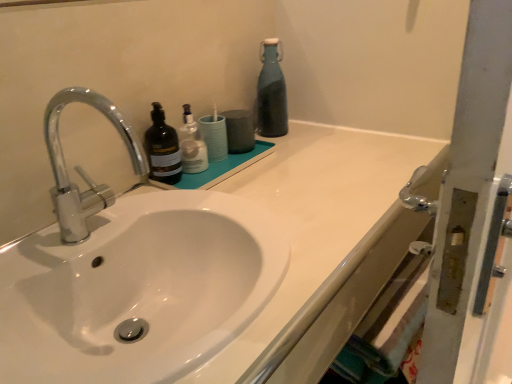
Question: Is teal glass bottle at upper right, the 1th bottle positioned from the back, bigger than white glossy sink at center?

Choices:
 (A) yes
 (B) no

Answer: (B)

Question: Is teal glass bottle at upper right, which is the 3th bottle from front to back, in contact with white glossy sink at center?

Choices:
 (A) no
 (B) yes

Answer: (A)

Question: Is teal glass bottle at upper right, acting as the first bottle starting from the right, aimed at white glossy sink at center?

Choices:
 (A) no
 (B) yes

Answer: (A)

Question: From a real-world perspective, is teal glass bottle at upper right, which is the 3th bottle from front to back, over white glossy sink at center?

Choices:
 (A) yes
 (B) no

Answer: (A)

Question: Does teal glass bottle at upper right, the 1th bottle positioned from the back, have a lesser width compared to white glossy sink at center?

Choices:
 (A) yes
 (B) no

Answer: (A)

Question: Does point (210, 117) appear closer or farther from the camera than point (164, 173)?

Choices:
 (A) farther
 (B) closer

Answer: (A)

Question: Considering the positions of white glossy bottle at upper center and matte black bottle at center, which appears as the 3th bottle when viewed from the back, in the image, is white glossy bottle at upper center taller or shorter than matte black bottle at center, which appears as the 3th bottle when viewed from the back,?

Choices:
 (A) short
 (B) tall

Answer: (A)

Question: Relative to matte black bottle at center, which appears as the first bottle when viewed from the front, is white glossy bottle at upper center in front or behind?

Choices:
 (A) front
 (B) behind

Answer: (B)

Question: Is white glossy bottle at upper center inside the boundaries of matte black bottle at center, the 1th bottle when ordered from left to right, or outside?

Choices:
 (A) outside
 (B) inside

Answer: (A)

Question: Considering the positions of polished chrome faucet at left and matte black bottle at center, which appears as the first bottle when viewed from the front, in the image, is polished chrome faucet at left taller or shorter than matte black bottle at center, which appears as the first bottle when viewed from the front,?

Choices:
 (A) tall
 (B) short

Answer: (A)

Question: From the image's perspective, is polished chrome faucet at left located above or below matte black bottle at center, which appears as the first bottle when viewed from the front?

Choices:
 (A) below
 (B) above

Answer: (A)

Question: Choose the correct answer: Is polished chrome faucet at left inside matte black bottle at center, which appears as the first bottle when viewed from the front, or outside it?

Choices:
 (A) inside
 (B) outside

Answer: (B)

Question: Would you say polished chrome faucet at left is to the left or to the right of matte black bottle at center, marked as the third bottle in a right-to-left arrangement, in the picture?

Choices:
 (A) right
 (B) left

Answer: (B)

Question: Considering the relative positions of polished chrome faucet at left and teal glass bottle at upper right, acting as the first bottle starting from the right, in the image provided, is polished chrome faucet at left to the left or to the right of teal glass bottle at upper right, acting as the first bottle starting from the right,?

Choices:
 (A) right
 (B) left

Answer: (B)

Question: Which is correct: polished chrome faucet at left is inside teal glass bottle at upper right, the 1th bottle positioned from the back, or outside of it?

Choices:
 (A) outside
 (B) inside

Answer: (A)